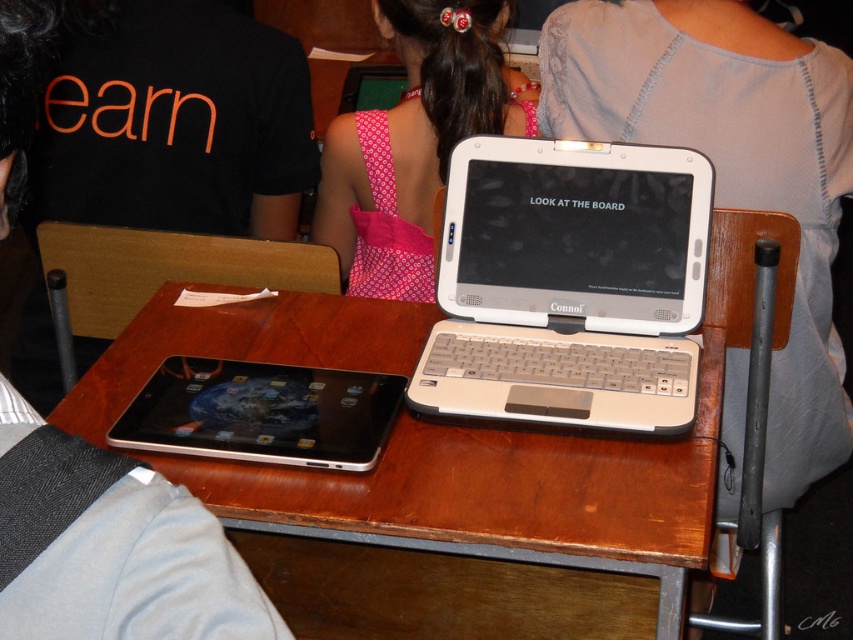
Measure the distance between white plastic laptop at center and silver metallic tablet at center.

A distance of 10.78 inches exists between white plastic laptop at center and silver metallic tablet at center.

Who is taller, white plastic laptop at center or silver metallic tablet at center?

white plastic laptop at center is taller.

Is point (625, 224) farther from viewer compared to point (396, 376)?

Yes, it is behind point (396, 376).

You are a GUI agent. You are given a task and a screenshot of the screen. Output one action in this format:
    pyautogui.click(x=<x>, y=<y>)
    Task: Click on the white plastic laptop at center
    The height and width of the screenshot is (640, 853).
    Given the screenshot: What is the action you would take?
    pyautogui.click(x=567, y=284)

Between black matte shirt at upper left and silver metallic tablet at center, which one has more height?

black matte shirt at upper left

Looking at this image, can you confirm if black matte shirt at upper left is positioned to the left of silver metallic tablet at center?

Correct, you'll find black matte shirt at upper left to the left of silver metallic tablet at center.

What do you see at coordinates (109, 547) in the screenshot? The height and width of the screenshot is (640, 853). I see `black matte shirt at upper left` at bounding box center [109, 547].

Find the location of a particular element. The image size is (853, 640). black matte shirt at upper left is located at coordinates (109, 547).

Does black matte shirt at upper left appear on the left side of pink fabric dress at upper center?

Correct, you'll find black matte shirt at upper left to the left of pink fabric dress at upper center.

What do you see at coordinates (109, 547) in the screenshot? The height and width of the screenshot is (640, 853). I see `black matte shirt at upper left` at bounding box center [109, 547].

The height and width of the screenshot is (640, 853). What are the coordinates of `black matte shirt at upper left` in the screenshot? It's located at (109, 547).